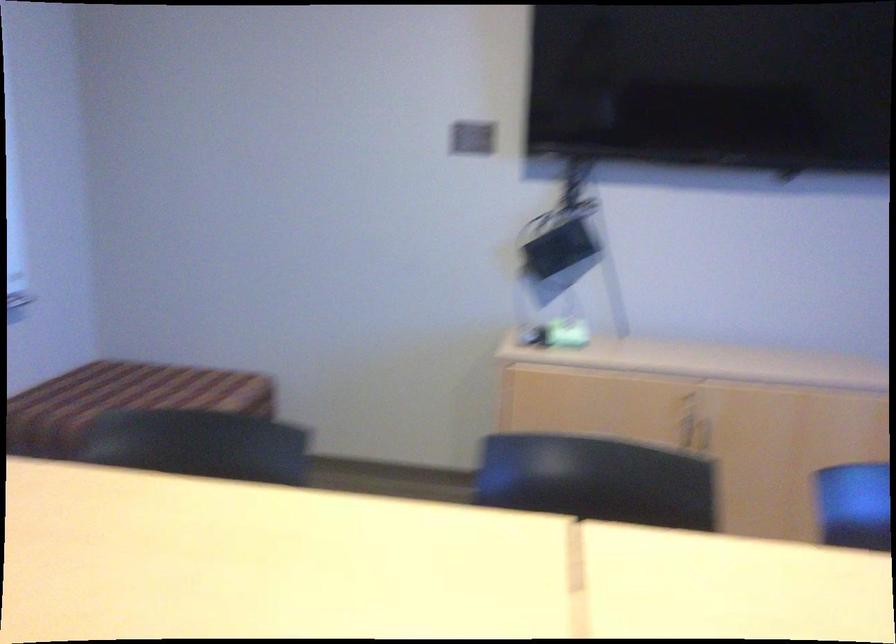
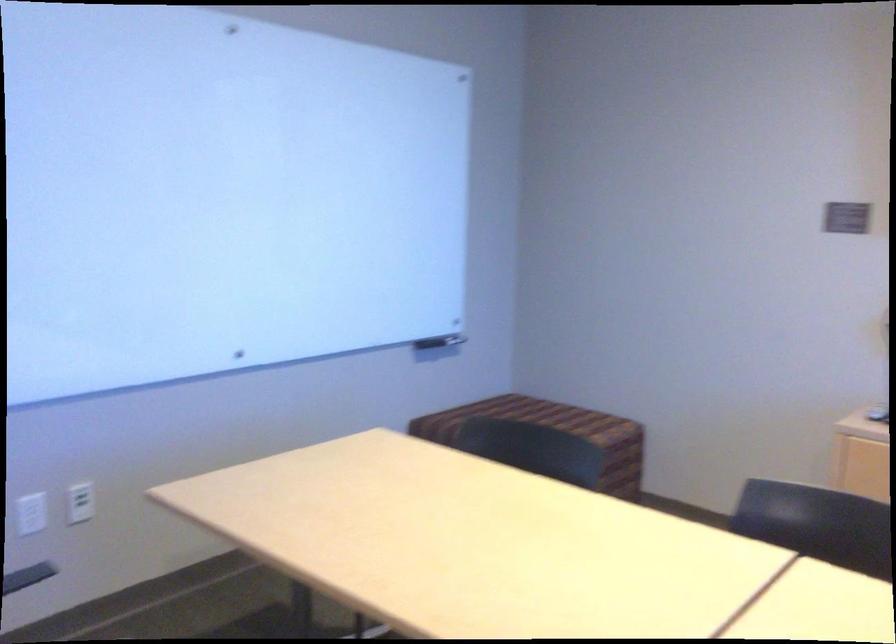
Question: The first image is from the beginning of the video and the second image is from the end. How did the camera likely rotate when shooting the video?

Choices:
 (A) Left
 (B) Right
 (C) Up
 (D) Down

Answer: (A)